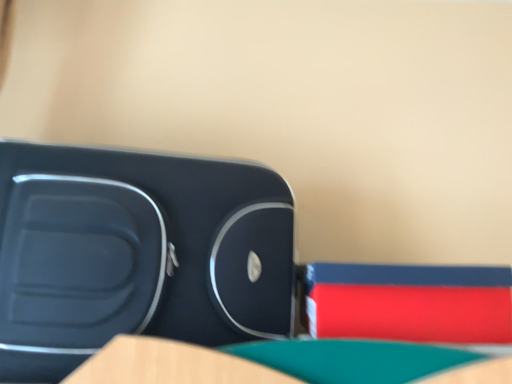
Question: Does matte plastic suitcase at left have a lesser width compared to rubberized red book at right?

Choices:
 (A) no
 (B) yes

Answer: (A)

Question: Can you confirm if matte plastic suitcase at left is smaller than rubberized red book at right?

Choices:
 (A) yes
 (B) no

Answer: (B)

Question: From the image's perspective, is matte plastic suitcase at left above rubberized red book at right?

Choices:
 (A) no
 (B) yes

Answer: (B)

Question: Is matte plastic suitcase at left at the left side of rubberized red book at right?

Choices:
 (A) yes
 (B) no

Answer: (A)

Question: Does matte plastic suitcase at left have a greater width compared to rubberized red book at right?

Choices:
 (A) no
 (B) yes

Answer: (B)

Question: Is matte plastic suitcase at left located outside rubberized red book at right?

Choices:
 (A) yes
 (B) no

Answer: (A)

Question: Considering the relative positions of rubberized red book at right and matte plastic suitcase at left in the image provided, is rubberized red book at right to the left of matte plastic suitcase at left from the viewer's perspective?

Choices:
 (A) no
 (B) yes

Answer: (A)

Question: Are rubberized red book at right and matte plastic suitcase at left beside each other?

Choices:
 (A) yes
 (B) no

Answer: (B)

Question: Is rubberized red book at right completely or partially outside of matte plastic suitcase at left?

Choices:
 (A) no
 (B) yes

Answer: (B)

Question: Is rubberized red book at right turned away from matte plastic suitcase at left?

Choices:
 (A) yes
 (B) no

Answer: (B)

Question: Is the depth of rubberized red book at right greater than that of matte plastic suitcase at left?

Choices:
 (A) yes
 (B) no

Answer: (A)

Question: Is rubberized red book at right positioned in front of matte plastic suitcase at left?

Choices:
 (A) yes
 (B) no

Answer: (B)

Question: Considering the positions of point (154, 220) and point (437, 294), is point (154, 220) closer or farther from the camera than point (437, 294)?

Choices:
 (A) closer
 (B) farther

Answer: (A)